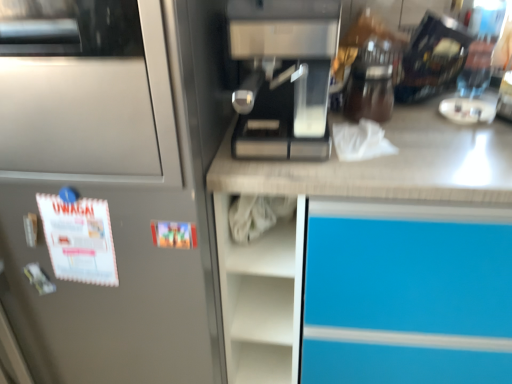
Question: Is sleek metallic coffee machine at center thinner than satin silver refrigerator at left?

Choices:
 (A) no
 (B) yes

Answer: (B)

Question: From a real-world perspective, is sleek metallic coffee machine at center over satin silver refrigerator at left?

Choices:
 (A) yes
 (B) no

Answer: (A)

Question: Does sleek metallic coffee machine at center turn towards satin silver refrigerator at left?

Choices:
 (A) yes
 (B) no

Answer: (B)

Question: Can you confirm if sleek metallic coffee machine at center is taller than satin silver refrigerator at left?

Choices:
 (A) yes
 (B) no

Answer: (B)

Question: Is sleek metallic coffee machine at center positioned with its back to satin silver refrigerator at left?

Choices:
 (A) no
 (B) yes

Answer: (A)

Question: From the image's perspective, is satin silver refrigerator at left positioned above or below sleek metallic coffee machine at center?

Choices:
 (A) below
 (B) above

Answer: (A)

Question: In terms of height, does satin silver refrigerator at left look taller or shorter compared to sleek metallic coffee machine at center?

Choices:
 (A) tall
 (B) short

Answer: (A)

Question: In terms of width, does satin silver refrigerator at left look wider or thinner when compared to sleek metallic coffee machine at center?

Choices:
 (A) thin
 (B) wide

Answer: (B)

Question: From a real-world perspective, relative to sleek metallic coffee machine at center, is satin silver refrigerator at left vertically above or below?

Choices:
 (A) below
 (B) above

Answer: (A)

Question: Visually, is sleek metallic coffee machine at center positioned to the left or to the right of black glossy coffee maker at upper right?

Choices:
 (A) left
 (B) right

Answer: (A)

Question: From the image's perspective, is sleek metallic coffee machine at center positioned above or below black glossy coffee maker at upper right?

Choices:
 (A) above
 (B) below

Answer: (B)

Question: Which is correct: sleek metallic coffee machine at center is inside black glossy coffee maker at upper right, or outside of it?

Choices:
 (A) inside
 (B) outside

Answer: (B)

Question: In terms of width, does sleek metallic coffee machine at center look wider or thinner when compared to black glossy coffee maker at upper right?

Choices:
 (A) wide
 (B) thin

Answer: (A)

Question: Is black glossy coffee maker at upper right situated inside sleek metallic coffee machine at center or outside?

Choices:
 (A) inside
 (B) outside

Answer: (B)

Question: Considering the positions of point (448, 38) and point (245, 102), is point (448, 38) closer or farther from the camera than point (245, 102)?

Choices:
 (A) closer
 (B) farther

Answer: (B)